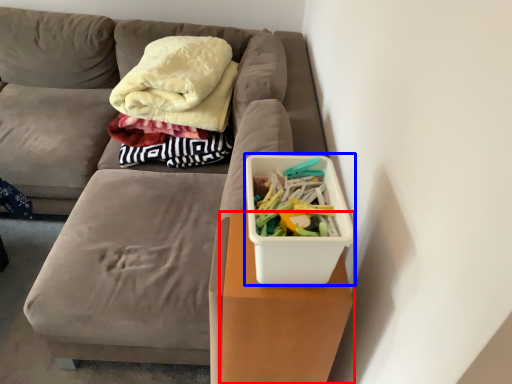
Question: Which object is further to the camera taking this photo, table (highlighted by a red box) or storage box (highlighted by a blue box)?

Choices:
 (A) table
 (B) storage box

Answer: (A)